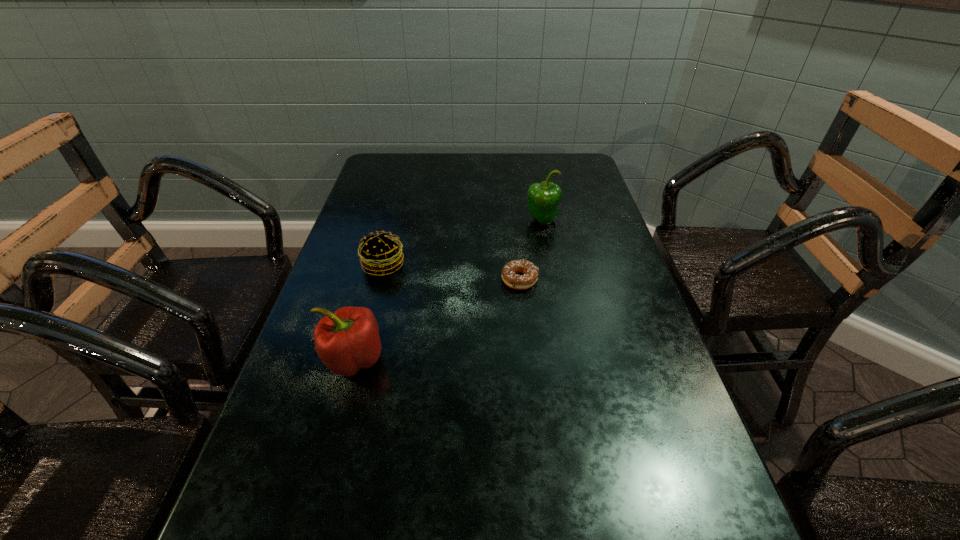
You are a GUI agent. You are given a task and a screenshot of the screen. Output one action in this format:
    pyautogui.click(x=<x>, y=<y>)
    Task: Click on the taller bell pepper
    
    Given the screenshot: What is the action you would take?
    pyautogui.click(x=543, y=199)

Where is `the farther bell pepper`? The image size is (960, 540). the farther bell pepper is located at coordinates (543, 199).

Locate an element on the screen. The height and width of the screenshot is (540, 960). the second tallest object is located at coordinates (347, 340).

At what (x,y) coordinates should I click in order to perform the action: click on the shorter bell pepper. Please return your answer as a coordinate pair (x, y). Looking at the image, I should click on (347, 340).

Find the location of a particular element. This screenshot has height=540, width=960. the second shortest object is located at coordinates (381, 253).

This screenshot has width=960, height=540. I want to click on doughnut, so click(530, 272).

The height and width of the screenshot is (540, 960). I want to click on free space located 0.140m on the back of the right bell pepper, so click(x=536, y=188).

The image size is (960, 540). What are the coordinates of `free location located on the front of the shorter bell pepper` in the screenshot? It's located at (335, 424).

In order to click on free space located on the right of the second shortest object in this screenshot , I will do `click(544, 265)`.

Find the location of a particular element. Image resolution: width=960 pixels, height=540 pixels. vacant region located on the back of the shortest object is located at coordinates (510, 187).